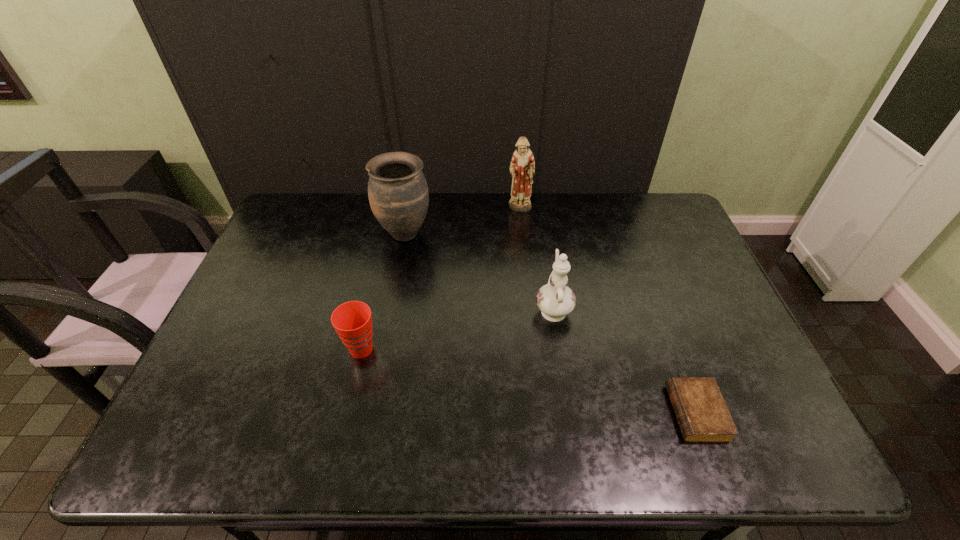
Where is `object located in the right edge section of the desktop`? Image resolution: width=960 pixels, height=540 pixels. object located in the right edge section of the desktop is located at coordinates (702, 415).

Locate an element on the screen. This screenshot has width=960, height=540. object situated at the near right corner is located at coordinates (702, 415).

The image size is (960, 540). Identify the location of vacant space at the far edge of the desktop. (347, 204).

At what (x,y) coordinates should I click in order to perform the action: click on vacant area at the near edge of the desktop. Please return your answer as a coordinate pair (x, y). This screenshot has height=540, width=960. Looking at the image, I should click on (636, 457).

Identify the location of free space at the left edge of the desktop. This screenshot has width=960, height=540. (246, 318).

The image size is (960, 540). Find the location of `vacant space at the far left corner of the desktop`. vacant space at the far left corner of the desktop is located at coordinates (325, 192).

Where is `free region at the near left corner of the desktop`? free region at the near left corner of the desktop is located at coordinates (230, 436).

Identify the location of vacant area at the far right corner. The image size is (960, 540). (662, 196).

The width and height of the screenshot is (960, 540). Identify the location of empty location between the rightmost object and the third shortest object. (625, 361).

This screenshot has height=540, width=960. I want to click on empty space between the chinaware and the urn, so click(x=479, y=271).